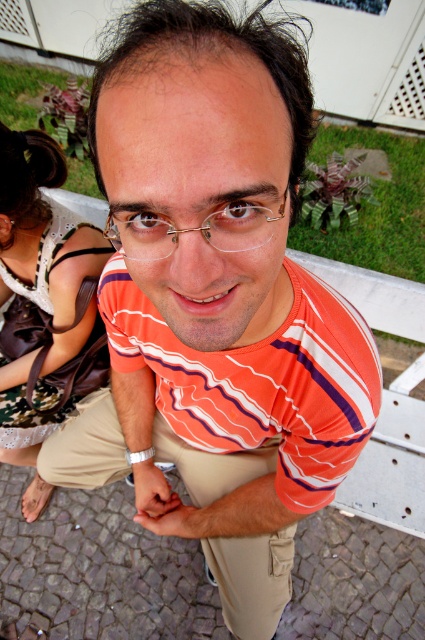
Does brown leather purse at left have a greater height compared to gold metallic glasses at center?

Indeed, brown leather purse at left has a greater height compared to gold metallic glasses at center.

Is point (16, 404) positioned behind point (175, 243)?

Yes.

What do you see at coordinates (44, 298) in the screenshot?
I see `brown leather purse at left` at bounding box center [44, 298].

Locate an element on the screen. This screenshot has width=425, height=640. brown leather purse at left is located at coordinates (44, 298).

Does brown leather purse at left appear on the right side of khaki pants at center?

In fact, brown leather purse at left is to the left of khaki pants at center.

Who is taller, brown leather purse at left or khaki pants at center?

Standing taller between the two is brown leather purse at left.

Does point (102, 355) lie in front of point (113, 465)?

No, (102, 355) is further to viewer.

Identify the location of brown leather purse at left. (44, 298).

Who is more forward, (x=261, y=461) or (x=209, y=218)?

Point (x=209, y=218) is in front.

Describe the element at coordinates (252, 579) in the screenshot. The height and width of the screenshot is (640, 425). I see `khaki pants at center` at that location.

Is point (186, 456) closer to camera compared to point (170, 227)?

No, it is behind (170, 227).

Find the location of `khaki pants at center`. khaki pants at center is located at coordinates (252, 579).